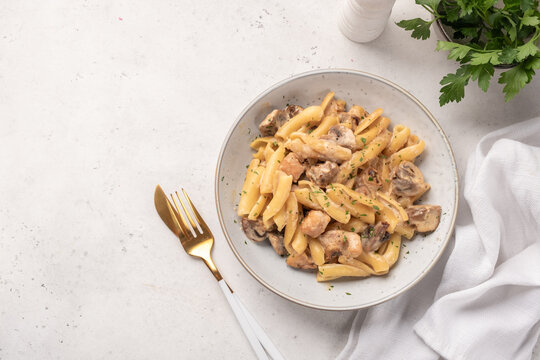
Where is `salt shaker`? This screenshot has width=540, height=360. salt shaker is located at coordinates (361, 21).